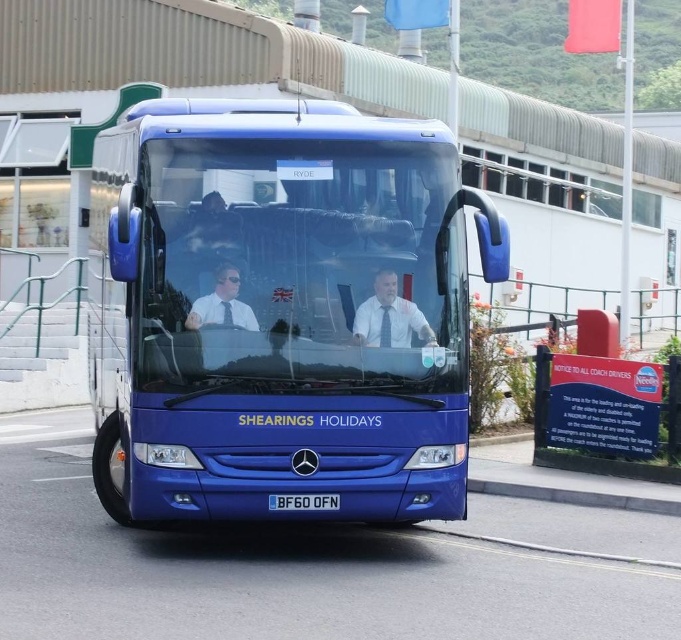
Question: Which point appears farthest from the camera in this image?

Choices:
 (A) (195, 106)
 (B) (398, 316)

Answer: (A)

Question: Can you confirm if blue metallic bus at center is positioned above blue plastic license plate at center?

Choices:
 (A) yes
 (B) no

Answer: (A)

Question: Which is nearer to the matte white shirt at center?

Choices:
 (A) blue plastic license plate at center
 (B) blue metallic bus at center

Answer: (B)

Question: Is matte white shirt at center to the right of blue plastic license plate at center from the viewer's perspective?

Choices:
 (A) yes
 (B) no

Answer: (A)

Question: Can you confirm if matte white shirt at center is positioned below blue plastic license plate at center?

Choices:
 (A) yes
 (B) no

Answer: (B)

Question: Which point appears farthest from the camera in this image?

Choices:
 (A) (206, 243)
 (B) (236, 280)
 (C) (289, 502)
 (D) (398, 339)

Answer: (D)